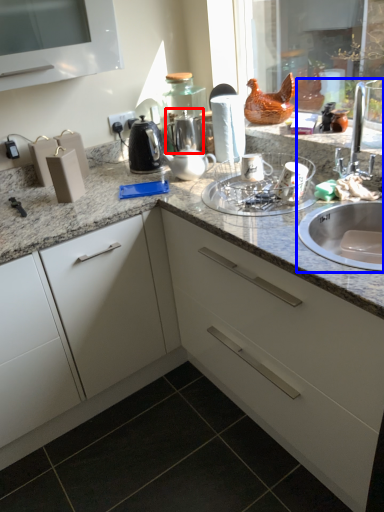
Question: Which object appears closest to the camera in this image, tea pot (highlighted by a red box) or sink (highlighted by a blue box)?

Choices:
 (A) tea pot
 (B) sink

Answer: (B)